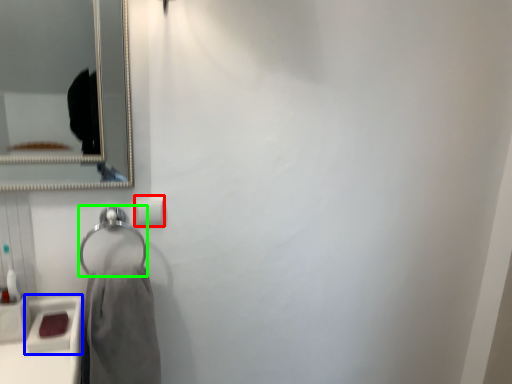
Question: Estimate the real-world distances between objects in this image. Which object is closer to toilet paper (highlighted by a red box), sink (highlighted by a blue box) or hang (highlighted by a green box)?

Choices:
 (A) sink
 (B) hang

Answer: (B)